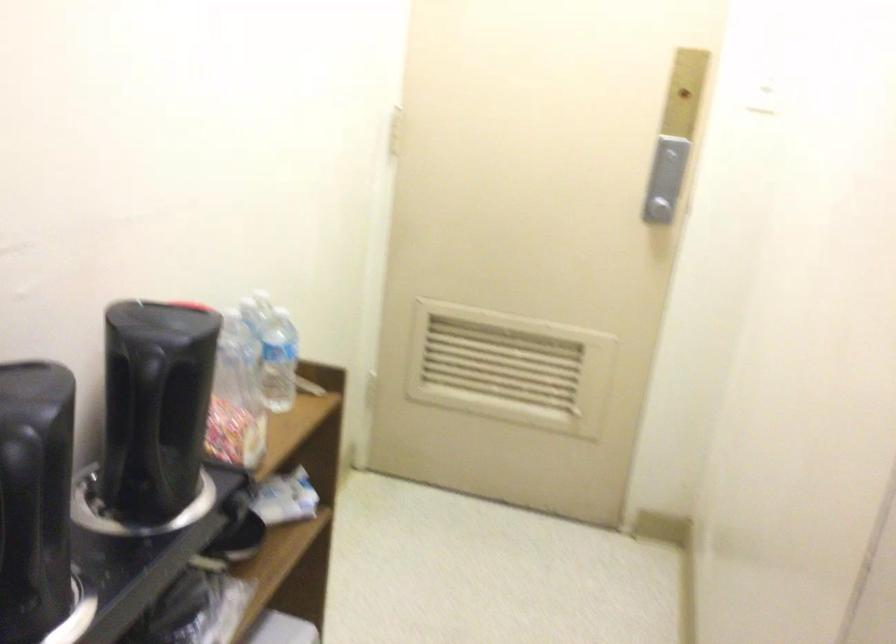
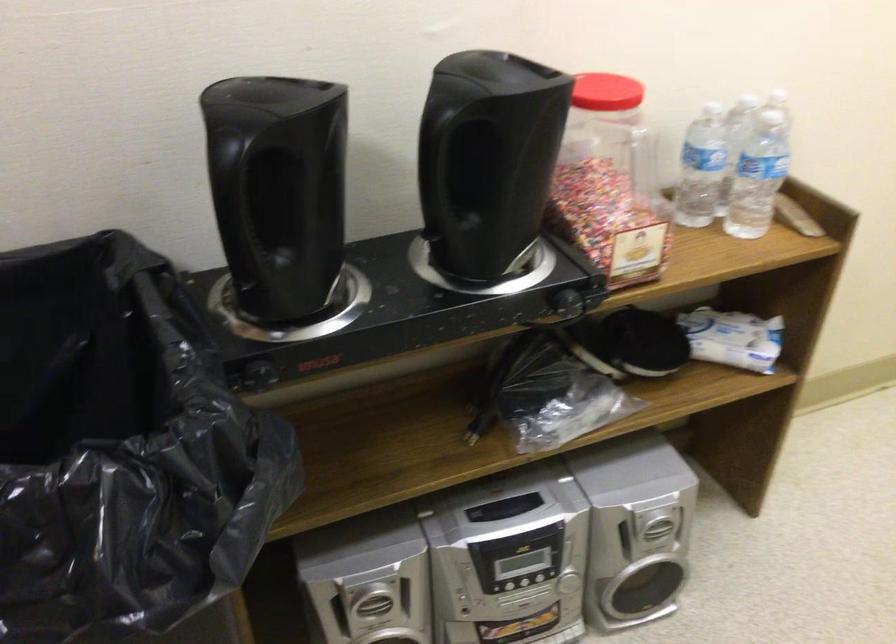
The point at (161, 415) is marked in the first image. Where is the corresponding point in the second image?

(435, 169)